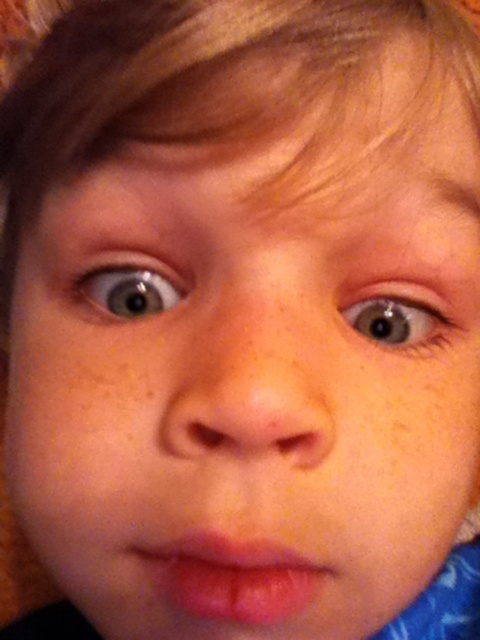
Question: From the image, what is the correct spatial relationship of pink glossy lips at center in relation to light brown eye at upper center?

Choices:
 (A) right
 (B) left

Answer: (A)

Question: Considering the relative positions of blue glossy eye at center and light brown eye at upper center in the image provided, where is blue glossy eye at center located with respect to light brown eye at upper center?

Choices:
 (A) above
 (B) below

Answer: (B)

Question: Among these points, which one is farthest from the camera?

Choices:
 (A) (119, 253)
 (B) (323, 572)
 (C) (397, 324)
 (D) (230, 307)

Answer: (C)

Question: Among these objects, which one is farthest from the camera?

Choices:
 (A) pink glossy lips at center
 (B) blue glossy eye at center

Answer: (B)

Question: Which object is closer to the camera taking this photo?

Choices:
 (A) pink glossy lips at center
 (B) smooth skin nose at center
 (C) light brown eye at upper center

Answer: (B)

Question: Does blue glossy eye at center have a lesser width compared to light brown eye at upper center?

Choices:
 (A) yes
 (B) no

Answer: (B)